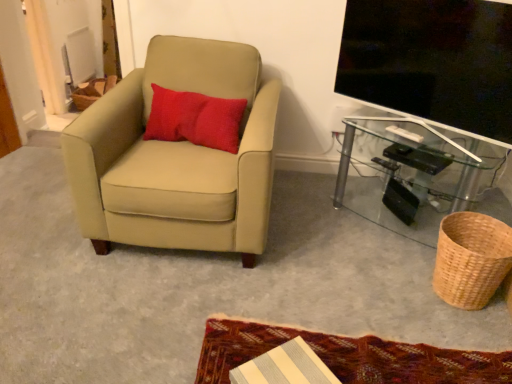
At what (x,y) coordinates should I click in order to perform the action: click on vacant space in between suede beige armchair at left and transparent glass table at lower right. Please return your answer as a coordinate pair (x, y). The width and height of the screenshot is (512, 384). Looking at the image, I should click on (318, 223).